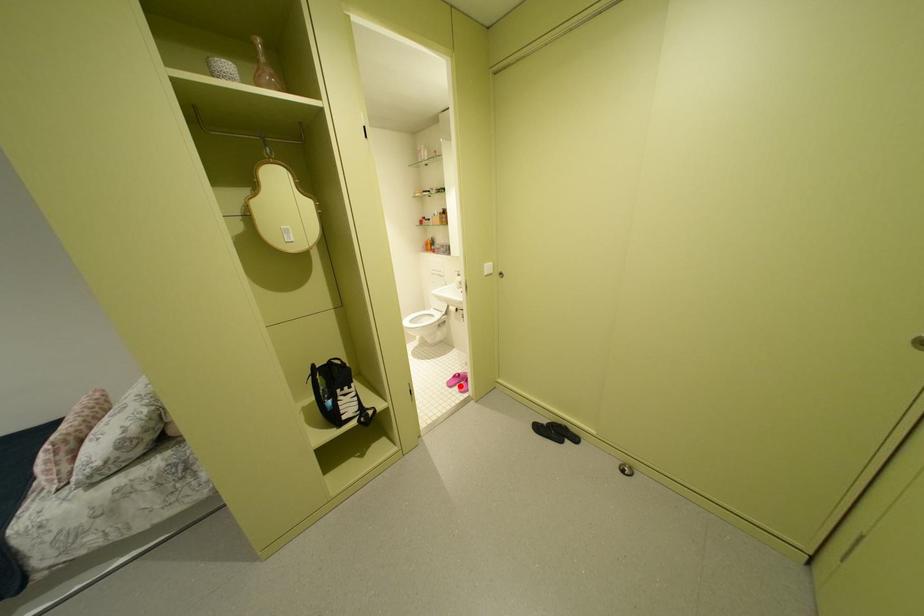
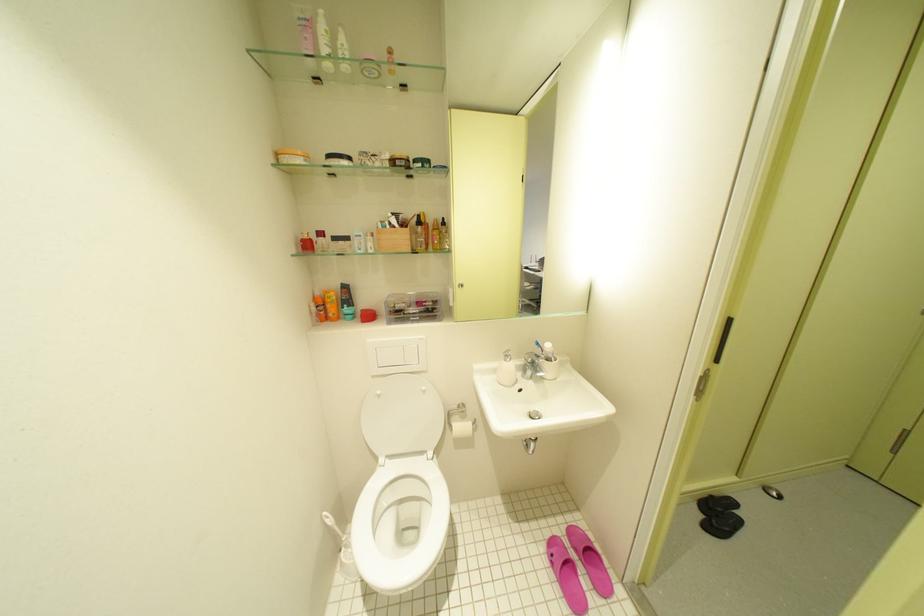
Question: I am providing you with two images of the same scene from different viewpoints. Image1 has a red point marked. In image2, the corresponding 3D location appears at what relative position? Reply with the corresponding letter.

Choices:
 (A) Closer
 (B) Farther

Answer: (A)